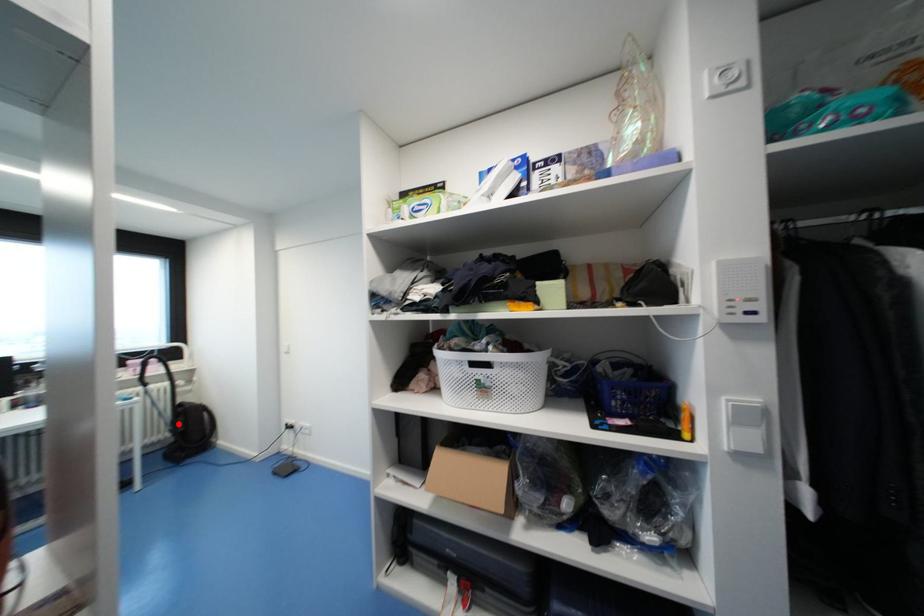
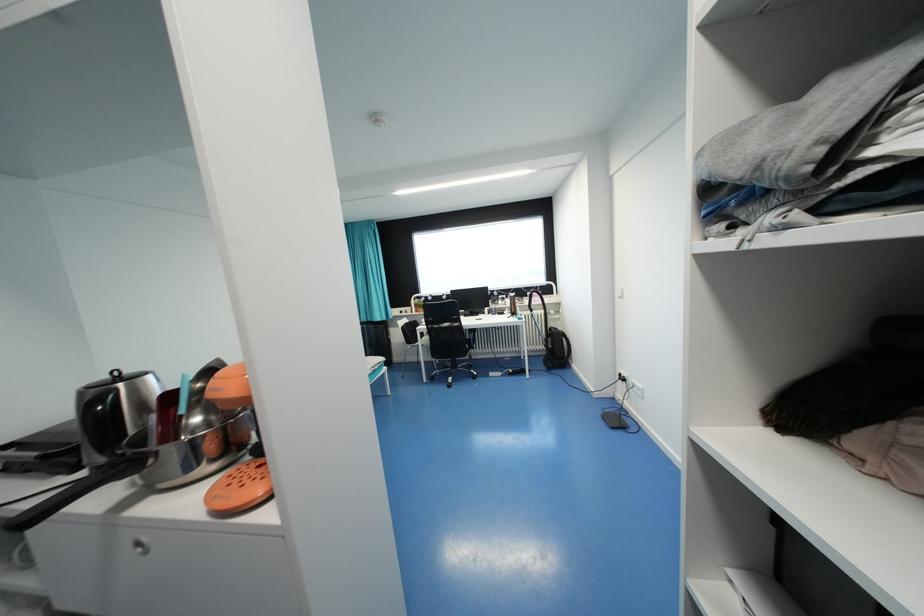
Question: I am providing you with two images of the same scene from different viewpoints. A red point is shown in image1. For the corresponding object point in image2, is it positioned nearer or farther from the camera?

Choices:
 (A) Nearer
 (B) Farther

Answer: (A)